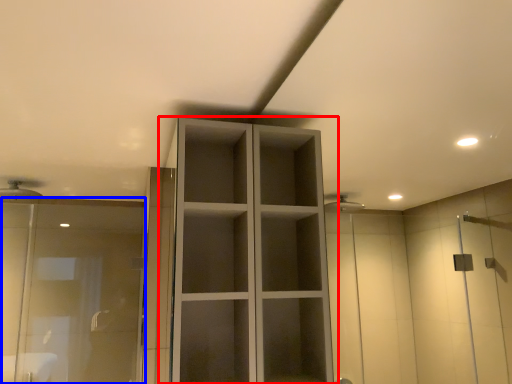
Question: Among these objects, which one is farthest to the camera, cupboard (highlighted by a red box) or screen door (highlighted by a blue box)?

Choices:
 (A) cupboard
 (B) screen door

Answer: (B)